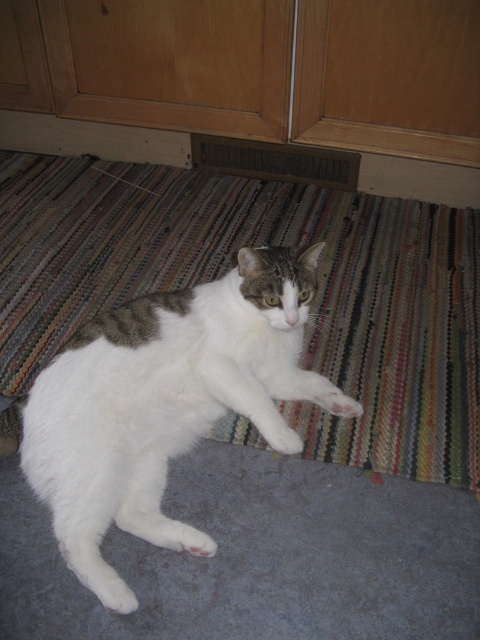
Question: Which of the following is the farthest from the observer?

Choices:
 (A) (435, 240)
 (B) (26, 413)

Answer: (A)

Question: Considering the real-world distances, which object is farthest from the striped carpet at lower center?

Choices:
 (A) white fur cat at center
 (B) white fur cat at lower left

Answer: (B)

Question: Considering the relative positions of striped carpet at lower center and white fur cat at center in the image provided, where is striped carpet at lower center located with respect to white fur cat at center?

Choices:
 (A) left
 (B) right

Answer: (A)

Question: Is striped carpet at lower center to the left of white fur cat at lower left from the viewer's perspective?

Choices:
 (A) no
 (B) yes

Answer: (B)

Question: Considering the real-world distances, which object is closest to the white fur cat at lower left?

Choices:
 (A) striped carpet at lower center
 (B) white fur cat at center

Answer: (B)

Question: In this image, where is white fur cat at lower left located relative to white fur cat at center?

Choices:
 (A) left
 (B) right

Answer: (B)